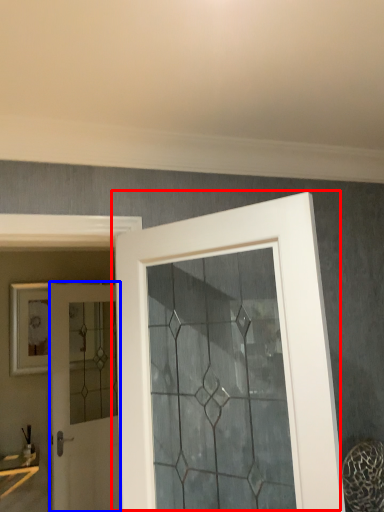
Question: Which of the following is the closest to the observer, door (highlighted by a red box) or door (highlighted by a blue box)?

Choices:
 (A) door
 (B) door

Answer: (A)